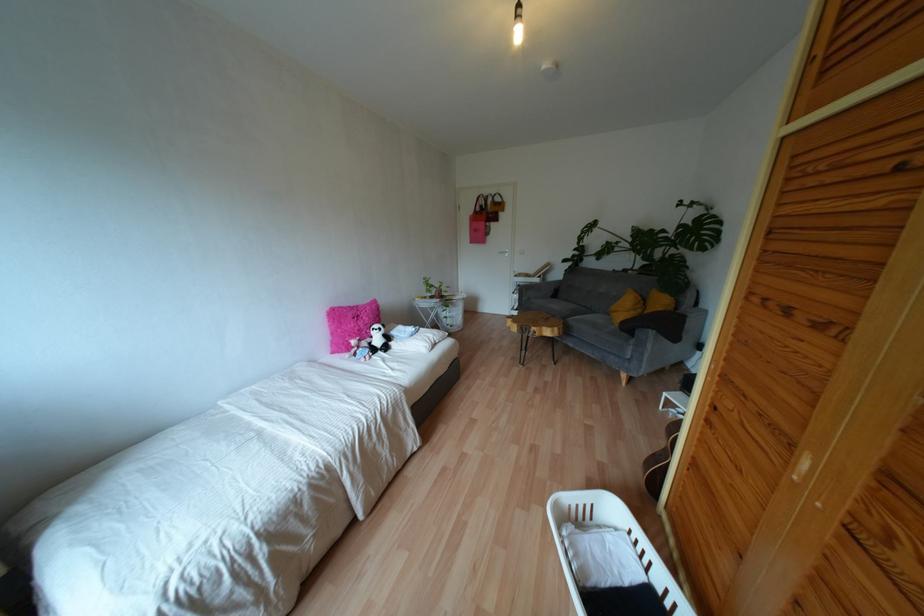
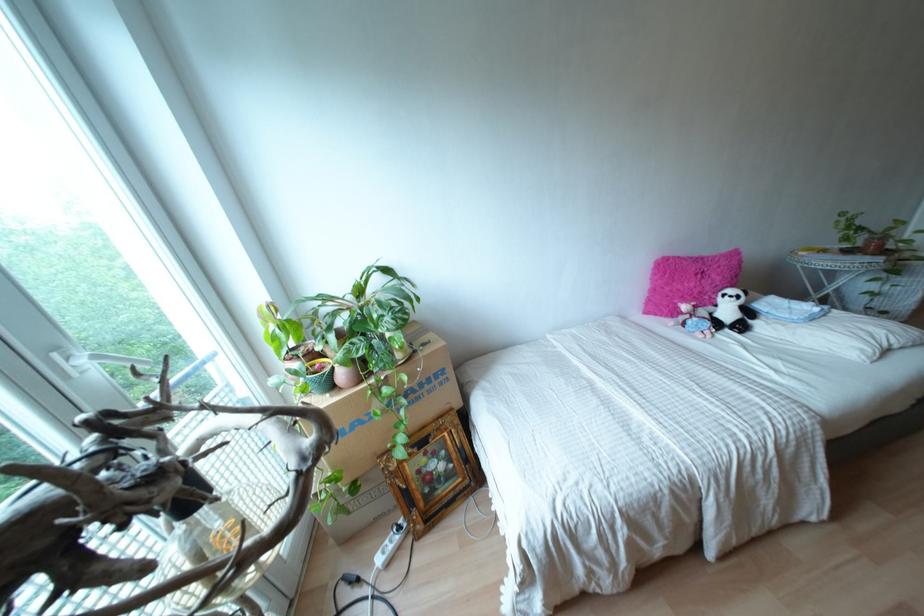
Find the pixel in the second image that matches pixel 386 337 in the first image.

(747, 312)